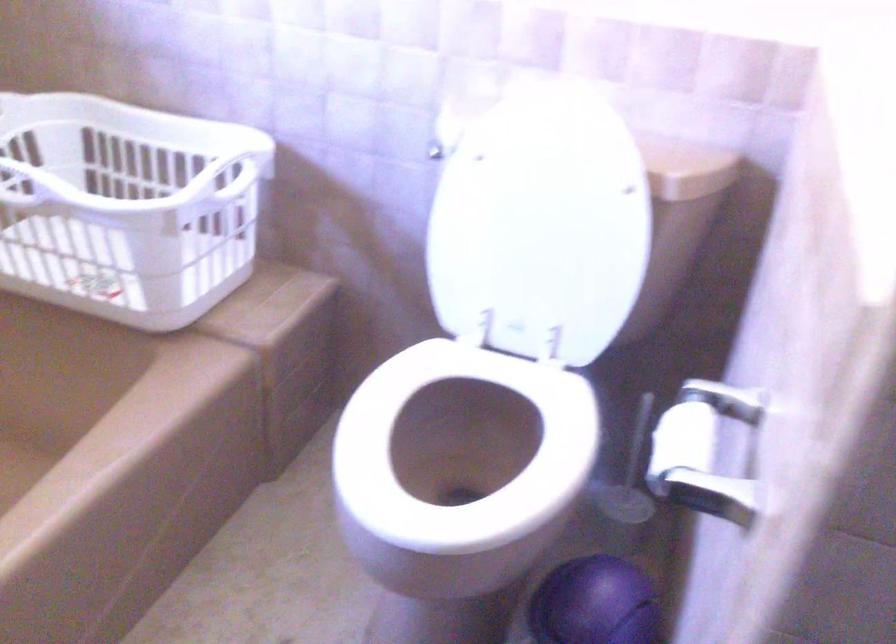
What do you see at coordinates (317, 506) in the screenshot?
I see `the white toilet seat` at bounding box center [317, 506].